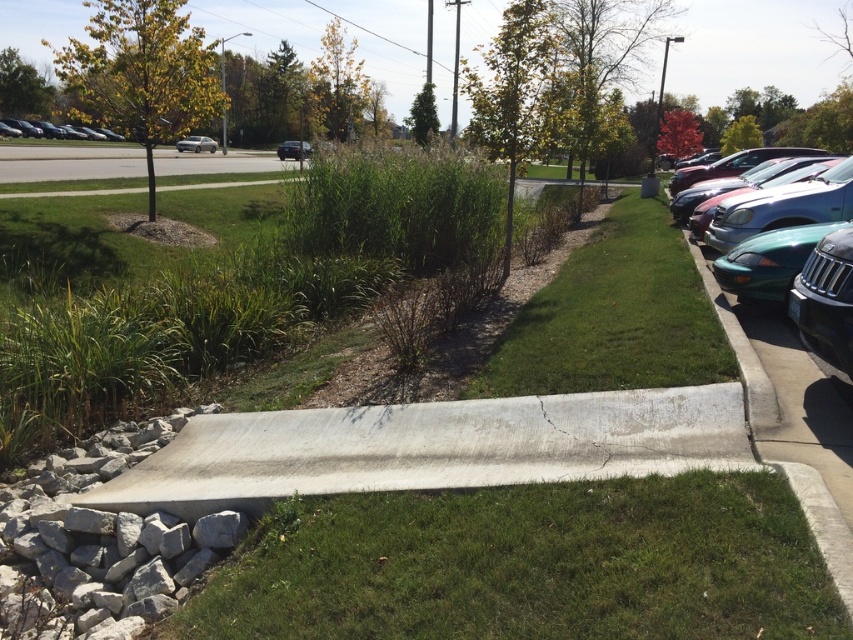
Question: Considering the relative positions of green grass at center and matte black car at left in the image provided, where is green grass at center located with respect to matte black car at left?

Choices:
 (A) right
 (B) left

Answer: (A)

Question: Is gray concrete curb at center bigger than matte black car at left?

Choices:
 (A) no
 (B) yes

Answer: (A)

Question: Considering the relative positions of green grass at center and teal glossy sedan at right in the image provided, where is green grass at center located with respect to teal glossy sedan at right?

Choices:
 (A) below
 (B) above

Answer: (A)

Question: Considering the real-world distances, which object is farthest from the matte black car at left?

Choices:
 (A) satin silver sedan at center-left
 (B) green grass at center
 (C) metallic silver sedan at center

Answer: (B)

Question: Which point is farther to the camera?

Choices:
 (A) (842, 200)
 (B) (683, 564)
 (C) (283, 154)

Answer: (C)

Question: Among these objects, which one is farthest from the camera?

Choices:
 (A) green grass at right
 (B) teal glossy sedan at right
 (C) gray concrete curb at center
 (D) green grass at center

Answer: (B)